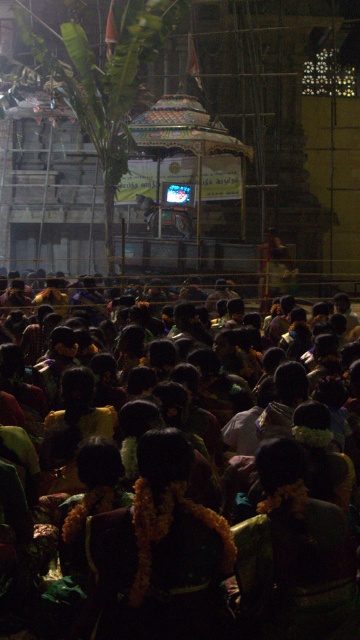
Question: Among these objects, which one is farthest from the camera?

Choices:
 (A) dark green fabric at center
 (B) green fabric at center

Answer: (A)

Question: Observing the image, what is the correct spatial positioning of green fabric at center in reference to dark green fabric at center?

Choices:
 (A) left
 (B) right

Answer: (B)

Question: Can you confirm if green fabric at center is smaller than dark green fabric at center?

Choices:
 (A) no
 (B) yes

Answer: (A)

Question: Which of the following is the closest to the observer?

Choices:
 (A) green fabric at center
 (B) dark green fabric at center

Answer: (A)

Question: Does green fabric at center have a larger size compared to dark green fabric at center?

Choices:
 (A) no
 (B) yes

Answer: (B)